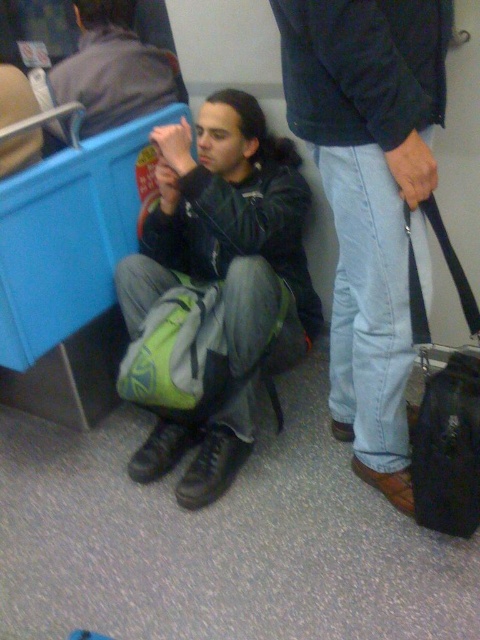
You are a passenger on a train and need to get to the exit door located behind the green fabric backpack at center. Can you walk past the light blue denim jeans at lower right to reach it?

The light blue denim jeans at lower right is in front of the green fabric backpack at center, so you can walk past the light blue denim jeans at lower right to reach the exit door behind the green fabric backpack at center.

You are standing in a public transportation vehicle and want to place your 2.5 feet wide luggage on the floor next to the green fabric backpack at center. Is there enough space between you and the backpack to do this?

The distance between the green fabric backpack at center and the viewer is 4.87 feet. Since the luggage is 2.5 feet wide, there is sufficient space as 4.87 feet is greater than 2.5 feet.